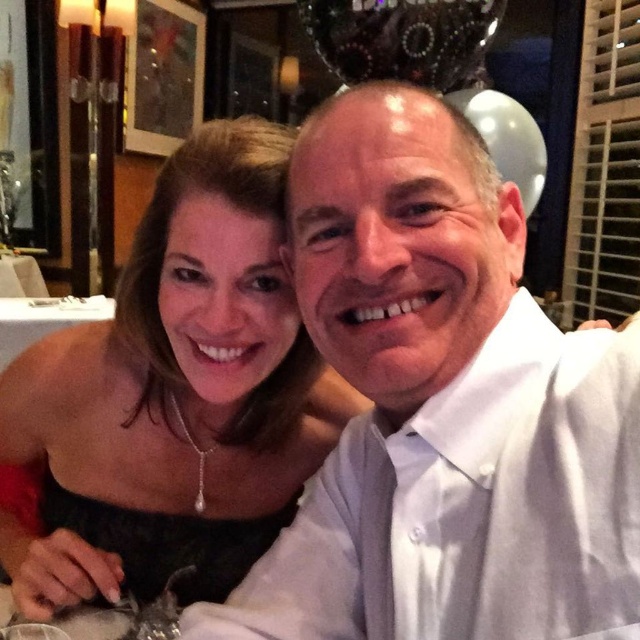
Question: Among these objects, which one is nearest to the camera?

Choices:
 (A) black satin dress at upper left
 (B) white smooth shirt at center

Answer: (B)

Question: Is white smooth shirt at center bigger than black satin dress at upper left?

Choices:
 (A) no
 (B) yes

Answer: (B)

Question: Which point appears farthest from the camera in this image?

Choices:
 (A) (198, 225)
 (B) (202, 609)

Answer: (A)

Question: Considering the relative positions of white smooth shirt at center and black satin dress at upper left in the image provided, where is white smooth shirt at center located with respect to black satin dress at upper left?

Choices:
 (A) left
 (B) right

Answer: (B)

Question: In this image, where is white smooth shirt at center located relative to black satin dress at upper left?

Choices:
 (A) right
 (B) left

Answer: (A)

Question: Among these objects, which one is nearest to the camera?

Choices:
 (A) black satin dress at upper left
 (B) white smooth shirt at center

Answer: (B)